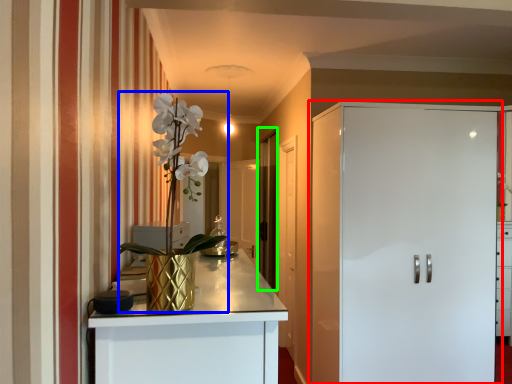
Question: Which object is the closest to the door (highlighted by a red box)? Choose among these: floral arrangement (highlighted by a blue box) or glass door (highlighted by a green box).

Choices:
 (A) floral arrangement
 (B) glass door

Answer: (A)